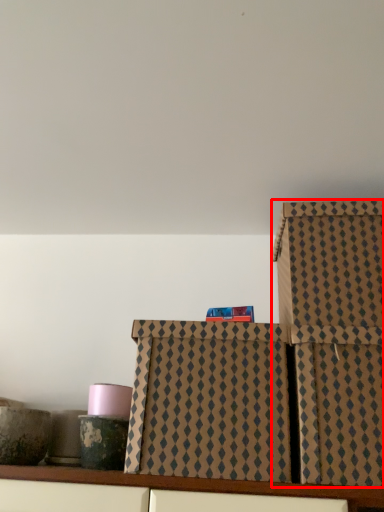
Question: From the image's perspective, where is box (annotated by the red box) located in relation to box in the image?

Choices:
 (A) above
 (B) below

Answer: (B)